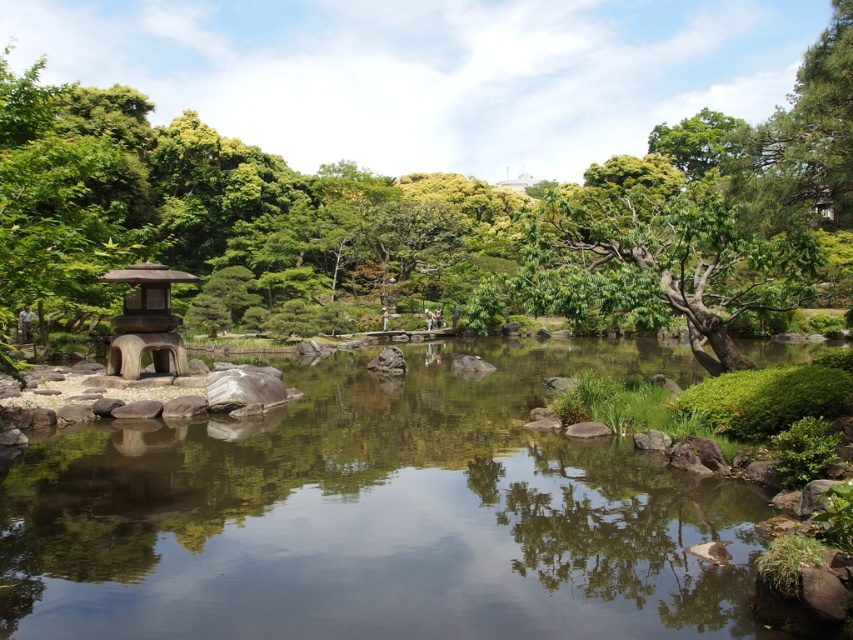
Can you confirm if green leafy tree at center-right is shorter than wooden lantern at left?

Incorrect, green leafy tree at center-right's height does not fall short of wooden lantern at left's.

Which is in front, point (639, 316) or point (120, 374)?

Point (639, 316)

The image size is (853, 640). In order to click on green leafy tree at center-right in this screenshot , I will do `click(660, 259)`.

Who is higher up, smooth bark tree at left or wooden lantern at left?

Positioned higher is smooth bark tree at left.

Between smooth bark tree at left and wooden lantern at left, which one is positioned lower?

wooden lantern at left is lower down.

Is point (596, 177) behind point (115, 360)?

Yes, it is behind point (115, 360).

Find the location of `smooth bark tree at left`. smooth bark tree at left is located at coordinates (427, 218).

Who is more distant from viewer, (306, 602) or (135, 300)?

Point (135, 300)

Between smooth stone stream at center and wooden lantern at left, which one appears on the left side from the viewer's perspective?

wooden lantern at left

Is point (196, 483) closer to camera compared to point (109, 280)?

Yes, it is.

This screenshot has height=640, width=853. Find the location of `smooth stone stream at center`. smooth stone stream at center is located at coordinates (376, 515).